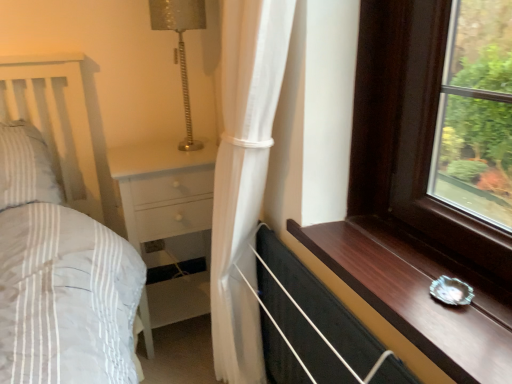
I want to click on free point above dark wood window sill at lower right (from a real-world perspective), so click(x=405, y=263).